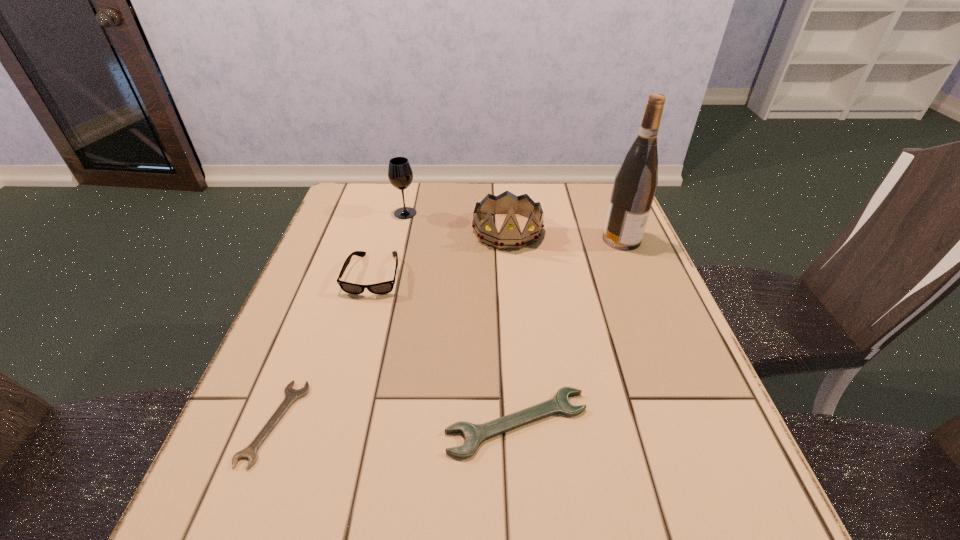
At what (x,y) coordinates should I click in order to perform the action: click on vacant region between the wineglass and the third nearest object. Please return your answer as a coordinate pair (x, y). Looking at the image, I should click on (390, 244).

This screenshot has height=540, width=960. I want to click on empty space that is in between the right wrench and the tallest object, so click(x=569, y=331).

The width and height of the screenshot is (960, 540). Find the location of `vacant region between the left wrench and the fifth tallest object`. vacant region between the left wrench and the fifth tallest object is located at coordinates (396, 423).

Where is `vacant area that lies between the second shortest object and the shorter wrench`? This screenshot has width=960, height=540. vacant area that lies between the second shortest object and the shorter wrench is located at coordinates (396, 423).

Find the location of a particular element. free space between the wineglass and the fifth tallest object is located at coordinates (461, 318).

Identify the location of unoccupied area between the tallest object and the sunglasses. (x=497, y=257).

Locate which object ranks fifth in proximity to the wine bottle. Please provide its 2D coordinates. Your answer should be formatted as a tuple, i.e. [(x, y)], where the tuple contains the x and y coordinates of a point satisfying the conditions above.

[(291, 395)]

Select which object is the second closest to the fourth farthest object. Please provide its 2D coordinates. Your answer should be formatted as a tuple, i.e. [(x, y)], where the tuple contains the x and y coordinates of a point satisfying the conditions above.

[(510, 236)]

The image size is (960, 540). Identify the location of free region that satisfies the following two spatial constraints: 1. on the front side of the wineglass; 2. on the left side of the tallest object. (399, 239).